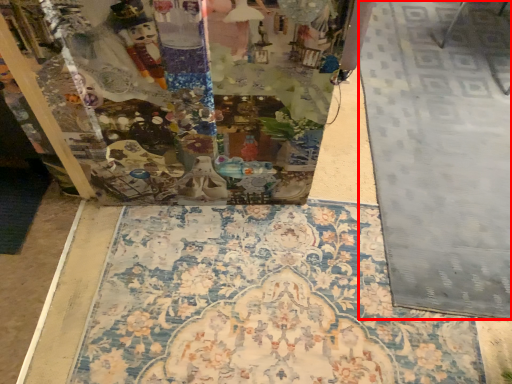
Question: From the image, what is the correct spatial relationship of tile (annotated by the red box) in relation to mat?

Choices:
 (A) left
 (B) right

Answer: (B)